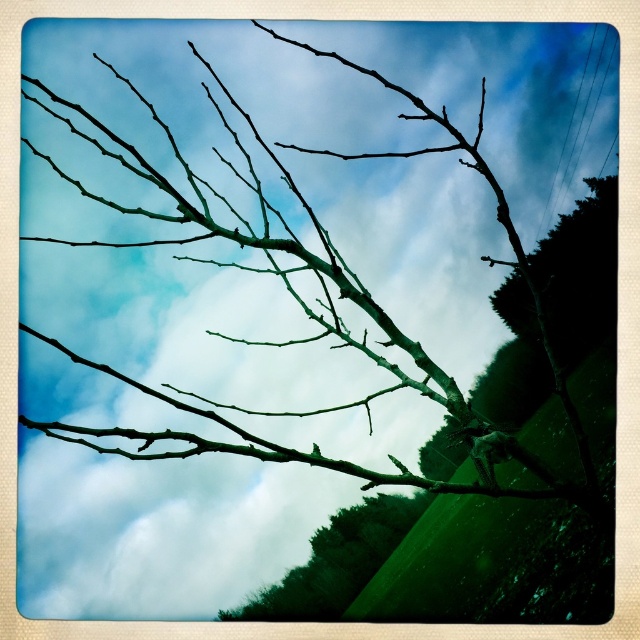
Between green matte tree branch at right and green matte tree branch at lower center, which one appears on the right side from the viewer's perspective?

From the viewer's perspective, green matte tree branch at right appears more on the right side.

This screenshot has width=640, height=640. Find the location of `green matte tree branch at right`. green matte tree branch at right is located at coordinates (579, 275).

Is point (516, 333) less distant than point (289, 572)?

No, (516, 333) is behind (289, 572).

Identify the location of green matte tree branch at right. The width and height of the screenshot is (640, 640). (579, 275).